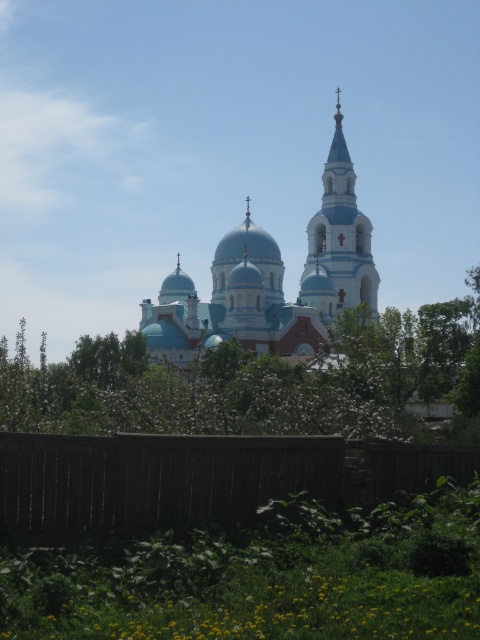
You are a photographer planning to capture the blue painted brick church at center and the smooth blue tower at center in a single frame. Based on their widths, which object should you position closer to the center of your camera frame to ensure both are fully visible?

The blue painted brick church at center has a greater width than the smooth blue tower at center. To ensure both are fully visible in the frame, position the blue painted brick church at center closer to the center of your camera frame so it occupies more space, while the narrower smooth blue tower at center can be placed towards the edge without being cut off.

You are standing in front of the church and notice the green leafy tree at center and the brown wooden fence at lower center. Which object is closer to the viewer?

The green leafy tree at center is positioned over the brown wooden fence at lower center, meaning it is closer to the viewer.

You are standing in front of the traditional Eastern Orthodox church with onion domes. You see a point marked at coordinates (262, 381). What object is located at this point?

The point at coordinates (262, 381) indicates a green leafy tree at center.